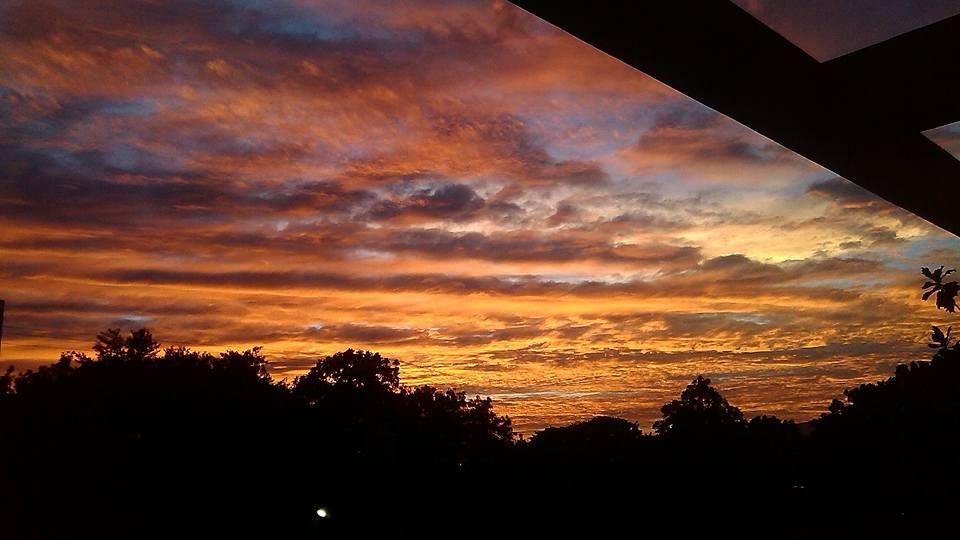
Locate an element on the screen. The width and height of the screenshot is (960, 540). frame is located at coordinates click(752, 70).